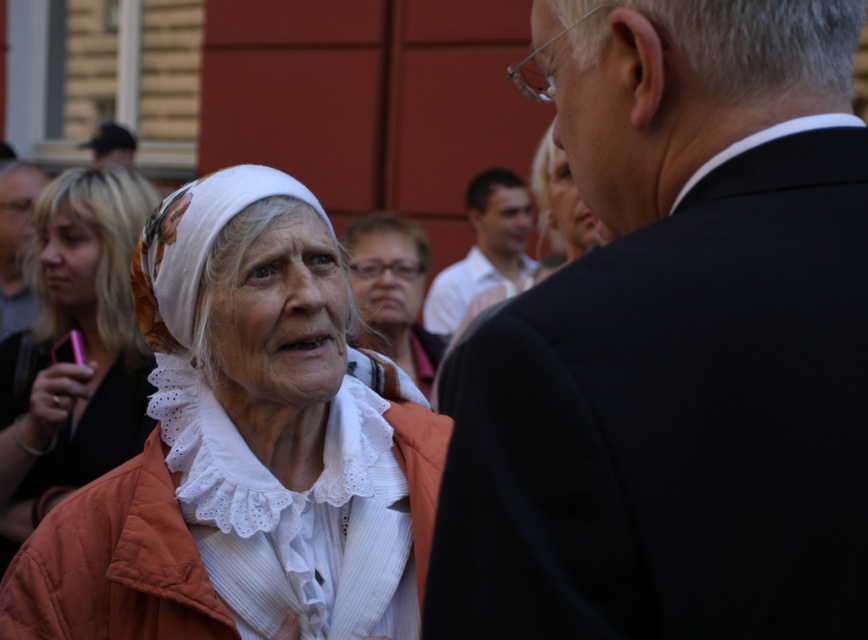
Does matte white scarf at center have a smaller size compared to white shirt at center?

Indeed, matte white scarf at center has a smaller size compared to white shirt at center.

Who is shorter, matte white scarf at center or white shirt at center?

With less height is matte white scarf at center.

Between point (424, 246) and point (510, 236), which one is positioned behind?

The point (510, 236) is behind.

You are a GUI agent. You are given a task and a screenshot of the screen. Output one action in this format:
    pyautogui.click(x=<x>, y=<y>)
    Task: Click on the matte white scarf at center
    The height and width of the screenshot is (640, 868).
    Given the screenshot: What is the action you would take?
    pyautogui.click(x=392, y=291)

Consider the image. How distant is matte white scarf at center from matte black suit at upper left?

A distance of 8.22 feet exists between matte white scarf at center and matte black suit at upper left.

Can you confirm if matte white scarf at center is positioned to the left of matte black suit at upper left?

Incorrect, matte white scarf at center is not on the left side of matte black suit at upper left.

At what (x,y) coordinates should I click in order to perform the action: click on matte white scarf at center. Please return your answer as a coordinate pair (x, y). The image size is (868, 640). Looking at the image, I should click on [x=392, y=291].

Which of these two, white lace blouse at lower left or matte black suit at upper left, stands taller?

white lace blouse at lower left

Who is shorter, white lace blouse at lower left or matte black suit at upper left?

matte black suit at upper left is shorter.

Is point (89, 244) farther from camera compared to point (0, 323)?

No.

The width and height of the screenshot is (868, 640). Find the location of `white lace blouse at lower left`. white lace blouse at lower left is located at coordinates (82, 348).